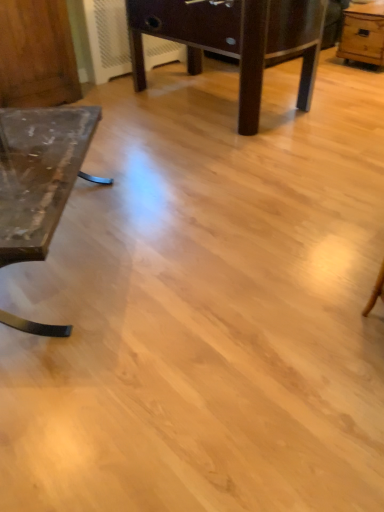
What do you see at coordinates (363, 34) in the screenshot? I see `light brown wooden table at upper right, arranged as the first table when viewed from the right` at bounding box center [363, 34].

How much space does matte glass table at left, placed as the third table when sorted from right to left, occupy vertically?

matte glass table at left, placed as the third table when sorted from right to left, is 18.18 inches in height.

The image size is (384, 512). In order to click on wooden dresser at left in this screenshot , I will do `click(36, 54)`.

Is matte glass table at left, placed as the third table when sorted from right to left, bigger than wooden dresser at left?

Yes, matte glass table at left, placed as the third table when sorted from right to left, is bigger than wooden dresser at left.

From the image's perspective, is matte glass table at left, placed as the third table when sorted from right to left, positioned above or below wooden dresser at left?

matte glass table at left, placed as the third table when sorted from right to left, is below wooden dresser at left.

How much distance is there between matte glass table at left, acting as the first table starting from the left, and wooden dresser at left?

matte glass table at left, acting as the first table starting from the left, is 4.80 feet from wooden dresser at left.

Is matte glass table at left, placed as the third table when sorted from right to left, outside of wooden dresser at left?

Yes.

Which is behind, dark brown wooden table at center, marked as the second table in a right-to-left arrangement, or light brown wooden table at upper right, arranged as the first table when viewed from the right?

light brown wooden table at upper right, arranged as the first table when viewed from the right, is further away from the camera.

From their relative heights in the image, would you say dark brown wooden table at center, the 2th table viewed from the left, is taller or shorter than light brown wooden table at upper right, placed as the third table when sorted from left to right?

Considering their sizes, dark brown wooden table at center, the 2th table viewed from the left, has more height than light brown wooden table at upper right, placed as the third table when sorted from left to right.

Identify the location of table above the light brown wooden table at upper right, arranged as the first table when viewed from the right (from a real-world perspective). This screenshot has height=512, width=384. (233, 40).

From a real-world perspective, is dark brown wooden table at center, the 2th table viewed from the left, positioned over light brown wooden table at upper right, arranged as the first table when viewed from the right, based on gravity?

Yes, from a real-world perspective, dark brown wooden table at center, the 2th table viewed from the left, is above light brown wooden table at upper right, arranged as the first table when viewed from the right.

Is dark brown wooden table at center, the 2th table viewed from the left, positioned beyond the bounds of matte glass table at left, placed as the third table when sorted from right to left?

Yes, dark brown wooden table at center, the 2th table viewed from the left, is not within matte glass table at left, placed as the third table when sorted from right to left.

Considering the sizes of objects dark brown wooden table at center, the 2th table viewed from the left, and matte glass table at left, acting as the first table starting from the left, in the image provided, who is bigger, dark brown wooden table at center, the 2th table viewed from the left, or matte glass table at left, acting as the first table starting from the left,?

Bigger between the two is dark brown wooden table at center, the 2th table viewed from the left.

Based on their positions, is dark brown wooden table at center, the 2th table viewed from the left, located to the left or right of matte glass table at left, placed as the third table when sorted from right to left?

Clearly, dark brown wooden table at center, the 2th table viewed from the left, is on the right of matte glass table at left, placed as the third table when sorted from right to left, in the image.

From a real-world perspective, who is located higher, dark brown wooden table at center, marked as the second table in a right-to-left arrangement, or matte glass table at left, placed as the third table when sorted from right to left?

dark brown wooden table at center, marked as the second table in a right-to-left arrangement, is physically above.

From a real-world perspective, is matte glass table at left, placed as the third table when sorted from right to left, positioned under light brown wooden table at upper right, arranged as the first table when viewed from the right, based on gravity?

Yes.

How many degrees apart are the facing directions of matte glass table at left, placed as the third table when sorted from right to left, and light brown wooden table at upper right, arranged as the first table when viewed from the right?

matte glass table at left, placed as the third table when sorted from right to left, and light brown wooden table at upper right, arranged as the first table when viewed from the right, are facing 48 degrees away from each other.

From the picture: Is matte glass table at left, acting as the first table starting from the left, aimed at light brown wooden table at upper right, placed as the third table when sorted from left to right?

No, matte glass table at left, acting as the first table starting from the left, is not aimed at light brown wooden table at upper right, placed as the third table when sorted from left to right.

Are matte glass table at left, acting as the first table starting from the left, and light brown wooden table at upper right, arranged as the first table when viewed from the right, making contact?

No, matte glass table at left, acting as the first table starting from the left, is not making contact with light brown wooden table at upper right, arranged as the first table when viewed from the right.

Which of these two, light brown wooden table at upper right, arranged as the first table when viewed from the right, or matte glass table at left, acting as the first table starting from the left, stands taller?

light brown wooden table at upper right, arranged as the first table when viewed from the right, is taller.

From the image's perspective, is light brown wooden table at upper right, arranged as the first table when viewed from the right, below matte glass table at left, placed as the third table when sorted from right to left?

Incorrect, from the image's perspective, light brown wooden table at upper right, arranged as the first table when viewed from the right, is higher than matte glass table at left, placed as the third table when sorted from right to left.

How far apart are light brown wooden table at upper right, arranged as the first table when viewed from the right, and matte glass table at left, placed as the third table when sorted from right to left?

A: A distance of 11.06 feet exists between light brown wooden table at upper right, arranged as the first table when viewed from the right, and matte glass table at left, placed as the third table when sorted from right to left.

Could you tell me if light brown wooden table at upper right, arranged as the first table when viewed from the right, is turned towards matte glass table at left, placed as the third table when sorted from right to left?

No.

Does light brown wooden table at upper right, placed as the third table when sorted from left to right, appear on the left side of wooden dresser at left?

In fact, light brown wooden table at upper right, placed as the third table when sorted from left to right, is to the right of wooden dresser at left.

How much distance is there between light brown wooden table at upper right, placed as the third table when sorted from left to right, and wooden dresser at left?

2.88 meters.

Where is `table behind the wooden dresser at left`? The height and width of the screenshot is (512, 384). table behind the wooden dresser at left is located at coordinates (363, 34).

Which of these two, light brown wooden table at upper right, arranged as the first table when viewed from the right, or wooden dresser at left, is thinner?

Thinner between the two is wooden dresser at left.

From the image's perspective, is light brown wooden table at upper right, arranged as the first table when viewed from the right, below dark brown wooden table at center, marked as the second table in a right-to-left arrangement?

Incorrect, from the image's perspective, light brown wooden table at upper right, arranged as the first table when viewed from the right, is higher than dark brown wooden table at center, marked as the second table in a right-to-left arrangement.

Is light brown wooden table at upper right, placed as the third table when sorted from left to right, positioned with its back to dark brown wooden table at center, the 2th table viewed from the left?

No, light brown wooden table at upper right, placed as the third table when sorted from left to right, is not facing away from dark brown wooden table at center, the 2th table viewed from the left.

Would you say light brown wooden table at upper right, placed as the third table when sorted from left to right, is outside dark brown wooden table at center, marked as the second table in a right-to-left arrangement?

Yes, light brown wooden table at upper right, placed as the third table when sorted from left to right, is outside of dark brown wooden table at center, marked as the second table in a right-to-left arrangement.

Locate an element on the screen. This screenshot has height=512, width=384. table behind the dark brown wooden table at center, the 2th table viewed from the left is located at coordinates (363, 34).

I want to click on dresser above the matte glass table at left, placed as the third table when sorted from right to left (from a real-world perspective), so click(36, 54).

This screenshot has width=384, height=512. Find the location of `table that is behind the dark brown wooden table at center, marked as the second table in a right-to-left arrangement`. table that is behind the dark brown wooden table at center, marked as the second table in a right-to-left arrangement is located at coordinates (363, 34).

Considering their positions, is wooden dresser at left positioned further to matte glass table at left, placed as the third table when sorted from right to left, than light brown wooden table at upper right, arranged as the first table when viewed from the right?

The object further to matte glass table at left, placed as the third table when sorted from right to left, is light brown wooden table at upper right, arranged as the first table when viewed from the right.

Consider the image. Which object lies further to the anchor point dark brown wooden table at center, marked as the second table in a right-to-left arrangement, wooden dresser at left or matte glass table at left, acting as the first table starting from the left?

The object further to dark brown wooden table at center, marked as the second table in a right-to-left arrangement, is matte glass table at left, acting as the first table starting from the left.

Which object lies further to the anchor point matte glass table at left, placed as the third table when sorted from right to left, light brown wooden table at upper right, placed as the third table when sorted from left to right, or wooden dresser at left?

Among the two, light brown wooden table at upper right, placed as the third table when sorted from left to right, is located further to matte glass table at left, placed as the third table when sorted from right to left.

When comparing their distances from light brown wooden table at upper right, placed as the third table when sorted from left to right, does wooden dresser at left or matte glass table at left, placed as the third table when sorted from right to left, seem further?

Among the two, matte glass table at left, placed as the third table when sorted from right to left, is located further to light brown wooden table at upper right, placed as the third table when sorted from left to right.

Looking at the image, which one is located closer to light brown wooden table at upper right, arranged as the first table when viewed from the right, dark brown wooden table at center, marked as the second table in a right-to-left arrangement, or matte glass table at left, placed as the third table when sorted from right to left?

dark brown wooden table at center, marked as the second table in a right-to-left arrangement, lies closer to light brown wooden table at upper right, arranged as the first table when viewed from the right, than the other object.

When comparing their distances from matte glass table at left, acting as the first table starting from the left, does light brown wooden table at upper right, arranged as the first table when viewed from the right, or dark brown wooden table at center, the 2th table viewed from the left, seem further?

light brown wooden table at upper right, arranged as the first table when viewed from the right, is further to matte glass table at left, acting as the first table starting from the left.

Estimate the real-world distances between objects in this image. Which object is further from dark brown wooden table at center, the 2th table viewed from the left, light brown wooden table at upper right, arranged as the first table when viewed from the right, or matte glass table at left, placed as the third table when sorted from right to left?

light brown wooden table at upper right, arranged as the first table when viewed from the right, is further to dark brown wooden table at center, the 2th table viewed from the left.

Which object lies nearer to the anchor point dark brown wooden table at center, the 2th table viewed from the left, matte glass table at left, placed as the third table when sorted from right to left, or wooden dresser at left?

wooden dresser at left.

The width and height of the screenshot is (384, 512). Find the location of `dresser between dark brown wooden table at center, the 2th table viewed from the left, and matte glass table at left, placed as the third table when sorted from right to left, in the up-down direction`. dresser between dark brown wooden table at center, the 2th table viewed from the left, and matte glass table at left, placed as the third table when sorted from right to left, in the up-down direction is located at coordinates (36, 54).

Identify the location of table situated between matte glass table at left, placed as the third table when sorted from right to left, and light brown wooden table at upper right, arranged as the first table when viewed from the right, from left to right. (233, 40).